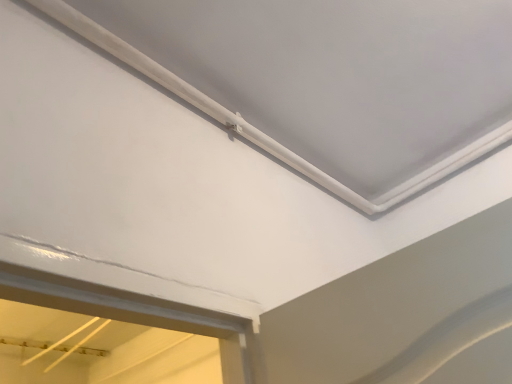
This screenshot has height=384, width=512. Describe the element at coordinates (327, 79) in the screenshot. I see `white plastic exhaust hood at upper center` at that location.

The image size is (512, 384). What are the coordinates of `white plastic exhaust hood at upper center` in the screenshot? It's located at (327, 79).

You are a GUI agent. You are given a task and a screenshot of the screen. Output one action in this format:
    pyautogui.click(x=<x>, y=<y>)
    Task: Click on the white plastic exhaust hood at upper center
    The image size is (512, 384).
    Given the screenshot: What is the action you would take?
    [327, 79]